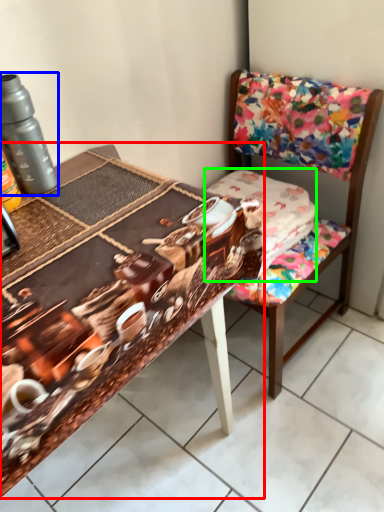
Question: Which object is positioned farthest from table (highlighted by a red box)? Select from bottle (highlighted by a blue box) and fabric (highlighted by a green box).

Choices:
 (A) bottle
 (B) fabric

Answer: (B)